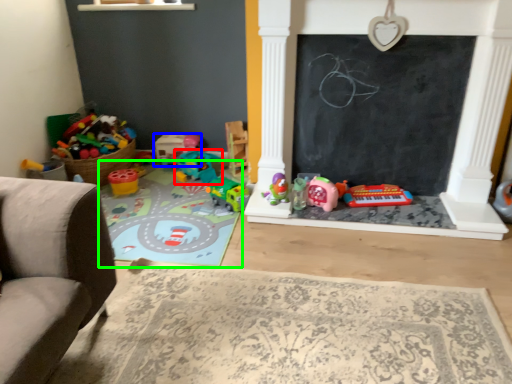
Question: Which is nearer to the toy (highlighted by a red box)? toy (highlighted by a blue box) or mat (highlighted by a green box).

Choices:
 (A) toy
 (B) mat

Answer: (A)